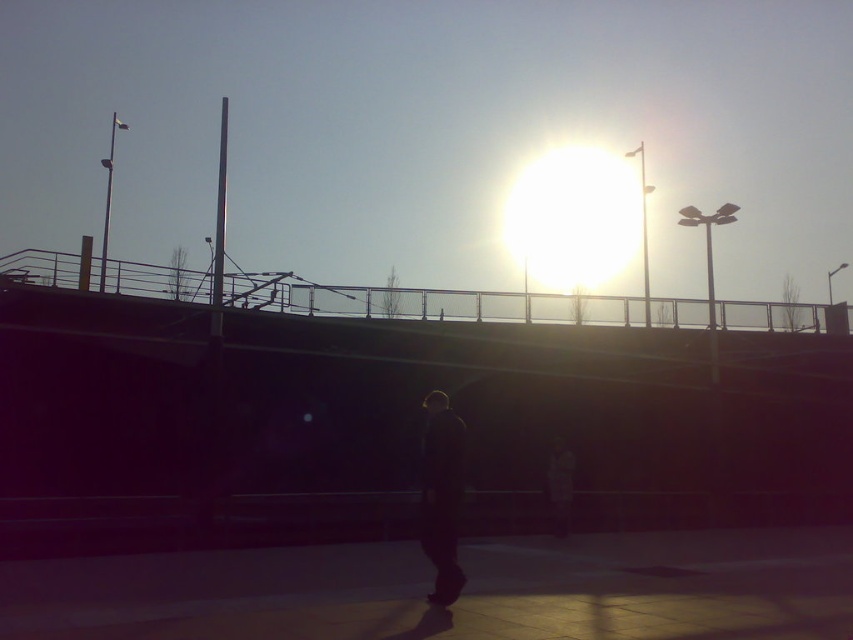
Can you confirm if dark fabric jacket at center is thinner than dark gray jacket at center?

Correct, dark fabric jacket at center's width is less than dark gray jacket at center's.

Can you confirm if dark fabric jacket at center is taller than dark gray jacket at center?

Yes, dark fabric jacket at center is taller than dark gray jacket at center.

Who is more forward, (439,540) or (558,516)?

Point (439,540)

This screenshot has height=640, width=853. Identify the location of dark fabric jacket at center. (440, 496).